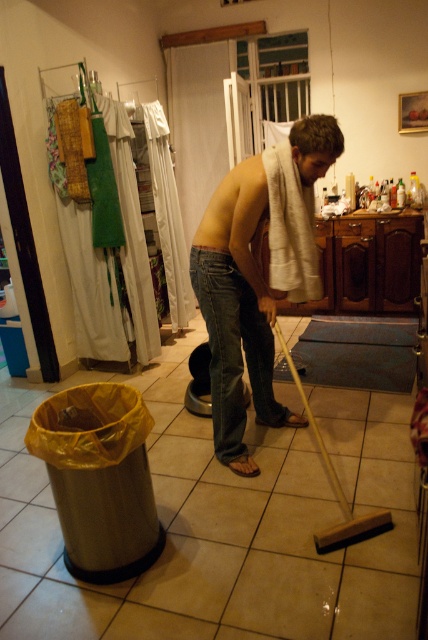
Question: Does shiny white towel at center appear on the right side of denim jeans at center?

Choices:
 (A) no
 (B) yes

Answer: (B)

Question: Which object is closer to the camera taking this photo?

Choices:
 (A) denim jeans at center
 (B) shiny white towel at center

Answer: (B)

Question: Can you confirm if shiny white towel at center is positioned to the right of denim jeans at center?

Choices:
 (A) no
 (B) yes

Answer: (B)

Question: Which of the following is the farthest from the observer?

Choices:
 (A) (297, 147)
 (B) (265, 410)

Answer: (B)

Question: Is shiny white towel at center below denim jeans at center?

Choices:
 (A) no
 (B) yes

Answer: (A)